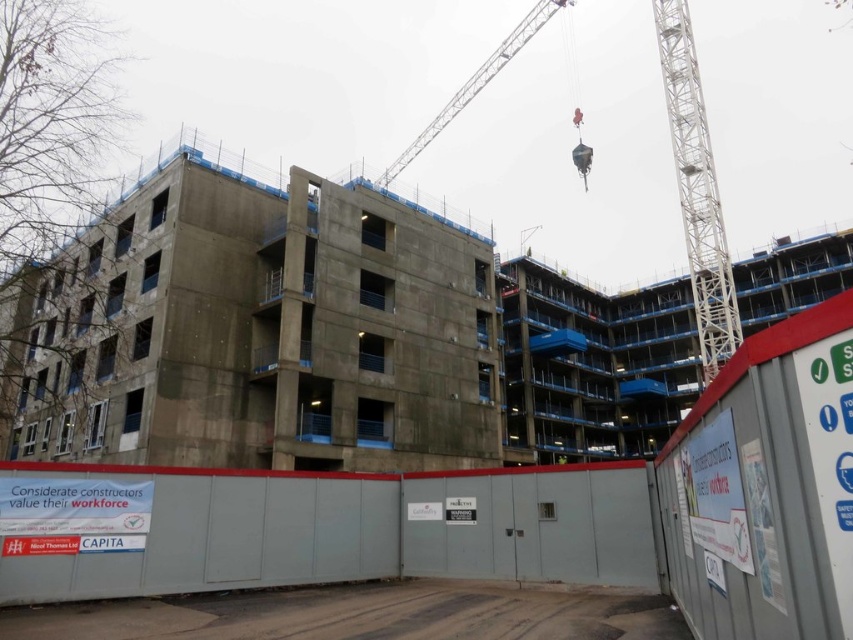
You are an inspector at the construction site. You need to determine which crane is nearer to you. The cranes are the white metallic crane at upper right and the metallic silver crane at upper center. Which one is closer?

The white metallic crane at upper right is closer to the viewer than the metallic silver crane at upper center.

You are a construction worker standing at the temporary fence with a red top border. You need to move the white metallic crane at upper center to a new location. Which direction should you move it to place it closer to the CAPITA sign on the fence?

The white metallic crane at upper center is located at point (695, 188). To move it closer to the CAPITA sign on the fence, you would need to adjust its position based on the specific coordinates provided in the Objects Description. However, without additional spatial information about the CAPITA sign location, an exact direction cannot be determined. Please provide more details about the CAPITA sign position for accurate guidance.